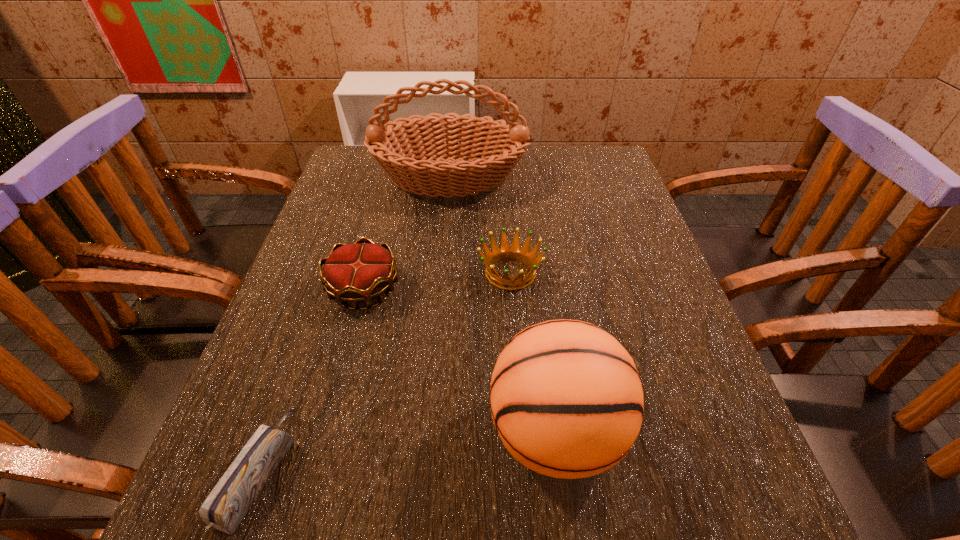
Image resolution: width=960 pixels, height=540 pixels. In order to click on vacant area situated on the right of the pencil box in this screenshot , I will do `click(522, 471)`.

I want to click on object present at the far edge, so click(x=408, y=156).

Locate an element on the screen. basketball that is positioned at the near edge is located at coordinates (566, 399).

Locate an element on the screen. The image size is (960, 540). pencil box that is at the near edge is located at coordinates (226, 505).

Identify the location of basket that is at the left edge. (408, 156).

Where is `crown that is at the left edge`? The image size is (960, 540). crown that is at the left edge is located at coordinates (355, 273).

You are a GUI agent. You are given a task and a screenshot of the screen. Output one action in this format:
    pyautogui.click(x=<x>, y=<y>)
    Task: Click on the pencil box at the left edge
    This screenshot has width=960, height=540.
    Given the screenshot: What is the action you would take?
    pyautogui.click(x=226, y=505)

Find the location of `object that is at the far left corner`. object that is at the far left corner is located at coordinates (408, 156).

Identify the location of object that is at the near left corner. (226, 505).

Find the location of a particular element. vacant area at the far edge of the desktop is located at coordinates (551, 161).